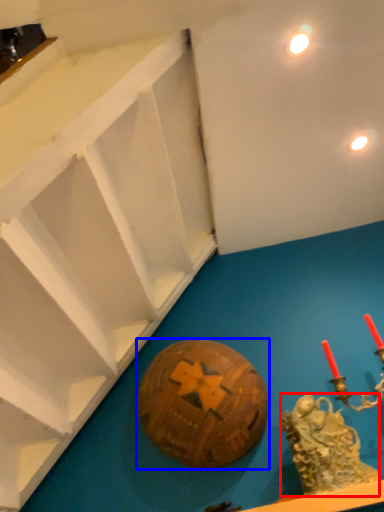
Question: Which point is further to the camera, type (highlighted by a red box) or ball (highlighted by a blue box)?

Choices:
 (A) type
 (B) ball

Answer: (B)